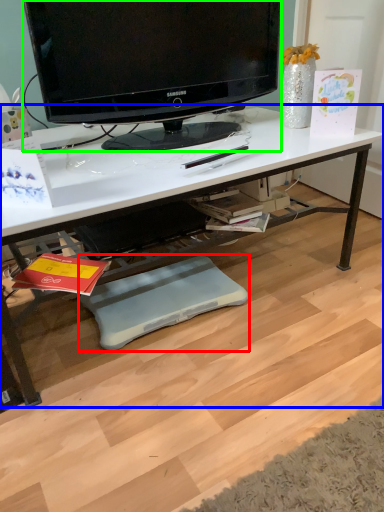
Question: Considering the real-world distances, which object is farthest from footrest (highlighted by a red box)? desk (highlighted by a blue box) or television (highlighted by a green box)?

Choices:
 (A) desk
 (B) television

Answer: (B)